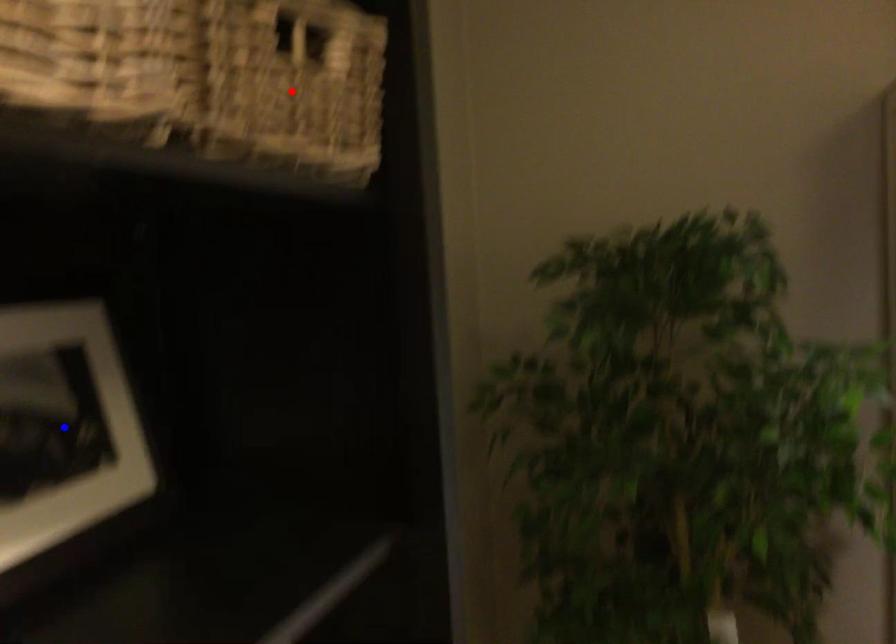
Question: In the image, two points are highlighted. Which point is nearer to the camera? Reply with the corresponding letter.

Choices:
 (A) blue point
 (B) red point

Answer: (B)